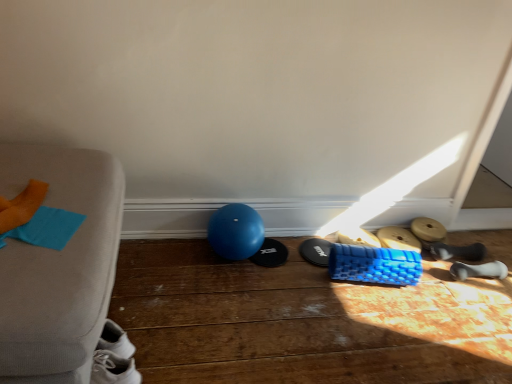
Question: Considering the relative sizes of blue textured foam roller at lower right, which is counted as the fourth footwear, starting from the right, and black rubber mat at center, the seventh footwear viewed from the right, in the image provided, is blue textured foam roller at lower right, which is counted as the fourth footwear, starting from the right, taller than black rubber mat at center, the seventh footwear viewed from the right,?

Choices:
 (A) yes
 (B) no

Answer: (A)

Question: Does blue textured foam roller at lower right, which is counted as the fourth footwear, starting from the right, turn towards black rubber mat at center, the seventh footwear viewed from the right?

Choices:
 (A) no
 (B) yes

Answer: (A)

Question: From the image's perspective, does blue textured foam roller at lower right, the 4th footwear when ordered from left to right, appear higher than black rubber mat at center, the seventh footwear viewed from the right?

Choices:
 (A) yes
 (B) no

Answer: (A)

Question: Does blue textured foam roller at lower right, the 4th footwear when ordered from left to right, contain black rubber mat at center, the first footwear when ordered from left to right?

Choices:
 (A) yes
 (B) no

Answer: (B)

Question: Is blue textured foam roller at lower right, which is counted as the fourth footwear, starting from the right, positioned beyond the bounds of black rubber mat at center, the first footwear when ordered from left to right?

Choices:
 (A) yes
 (B) no

Answer: (A)

Question: Considering the positions of black rubber mat at center, the first footwear when ordered from left to right, and blue textured foam roller at lower right, the 4th footwear when ordered from left to right, in the image, is black rubber mat at center, the first footwear when ordered from left to right, taller or shorter than blue textured foam roller at lower right, the 4th footwear when ordered from left to right,?

Choices:
 (A) tall
 (B) short

Answer: (B)

Question: Is black rubber mat at center, the first footwear when ordered from left to right, situated inside blue textured foam roller at lower right, which is counted as the fourth footwear, starting from the right, or outside?

Choices:
 (A) inside
 (B) outside

Answer: (B)

Question: Considering the positions of black rubber mat at center, the first footwear when ordered from left to right, and blue textured foam roller at lower right, the 4th footwear when ordered from left to right, in the image, is black rubber mat at center, the first footwear when ordered from left to right, wider or thinner than blue textured foam roller at lower right, the 4th footwear when ordered from left to right,?

Choices:
 (A) thin
 (B) wide

Answer: (A)

Question: Based on their positions, is black rubber mat at center, the seventh footwear viewed from the right, located to the left or right of blue textured foam roller at lower right, which is counted as the fourth footwear, starting from the right?

Choices:
 (A) left
 (B) right

Answer: (A)

Question: Looking at their shapes, would you say blue rubber ball at center is wider or thinner than black rubber mat at center, the first footwear when ordered from left to right?

Choices:
 (A) thin
 (B) wide

Answer: (B)

Question: Considering the positions of blue rubber ball at center and black rubber mat at center, the seventh footwear viewed from the right, in the image, is blue rubber ball at center taller or shorter than black rubber mat at center, the seventh footwear viewed from the right,?

Choices:
 (A) tall
 (B) short

Answer: (A)

Question: From the image's perspective, is blue rubber ball at center positioned above or below black rubber mat at center, the seventh footwear viewed from the right?

Choices:
 (A) above
 (B) below

Answer: (A)

Question: Relative to black rubber mat at center, the seventh footwear viewed from the right, is blue rubber ball at center in front or behind?

Choices:
 (A) front
 (B) behind

Answer: (A)

Question: Is point (394, 238) positioned closer to the camera than point (415, 231)?

Choices:
 (A) closer
 (B) farther

Answer: (A)

Question: Is blue textured foam roller at lower right, the 4th footwear when ordered from left to right, to the left or to the right of wooden dumbbell at lower right, which appears as the fifth footwear when viewed from the left, in the image?

Choices:
 (A) right
 (B) left

Answer: (B)